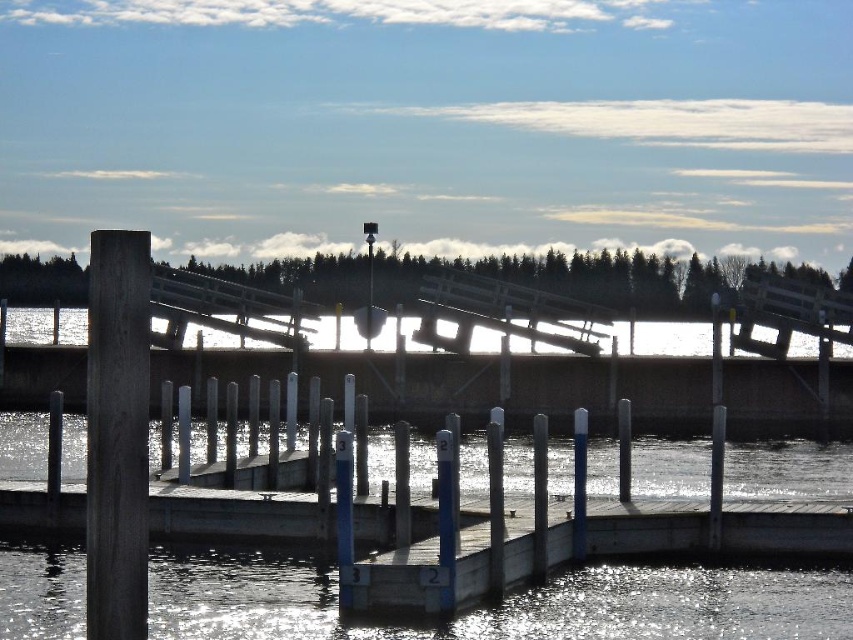
You are standing on the wooden dock and looking towards the water. Which object, the clear water at dock center or the dark wood post at left, is located closer to the edge of the dock?

The clear water at dock center is located closer to the edge of the dock because it is positioned below the dark wood post at left, indicating it is further out on the dock.

You are standing on the wooden dock and notice two elements in front of you. One is the clear water at dock center and the other is the dark wood post at left. Which of these two items takes up more space visually in the scene?

The dark wood post at left takes up more space visually in the scene because the clear water at dock center occupies less space than dark wood post at left according to the description.

You are standing at the camera position and want to reach the point at coordinates point (x=258, y=621). If your maximum walking distance is 70 feet, can you reach it without exceeding your limit?

The distance between you and point (x=258, y=621) is 69.20 feet, which is within your 70 feet limit. Yes, you can reach it without exceeding your limit.